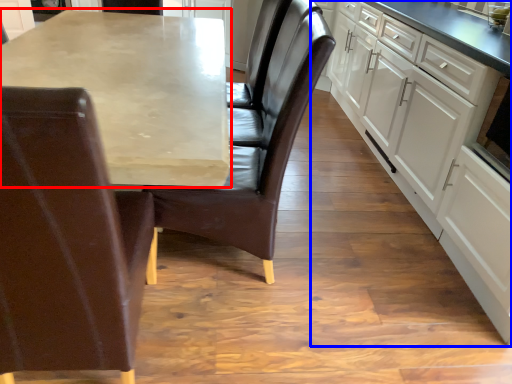
Question: Which of the following is the farthest to the observer, countertop (highlighted by a red box) or cabinetry (highlighted by a blue box)?

Choices:
 (A) countertop
 (B) cabinetry

Answer: (B)